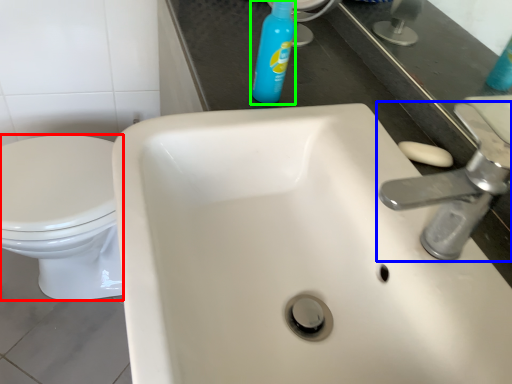
Question: Estimate the real-world distances between objects in this image. Which object is farther from bidet (highlighted by a red box), tap (highlighted by a blue box) or cleaning product (highlighted by a green box)?

Choices:
 (A) tap
 (B) cleaning product

Answer: (A)